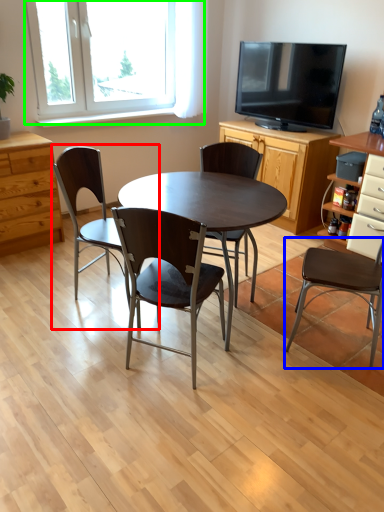
Question: Which is nearer to the chair (highlighted by a red box)? chair (highlighted by a blue box) or window (highlighted by a green box).

Choices:
 (A) chair
 (B) window

Answer: (A)